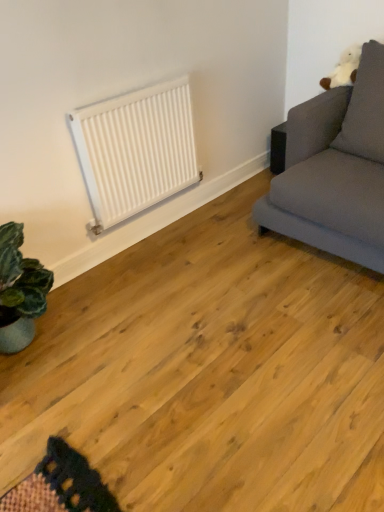
The image size is (384, 512). Identify the location of free spot above white matte radiator at upper center (from a real-world perspective). (118, 85).